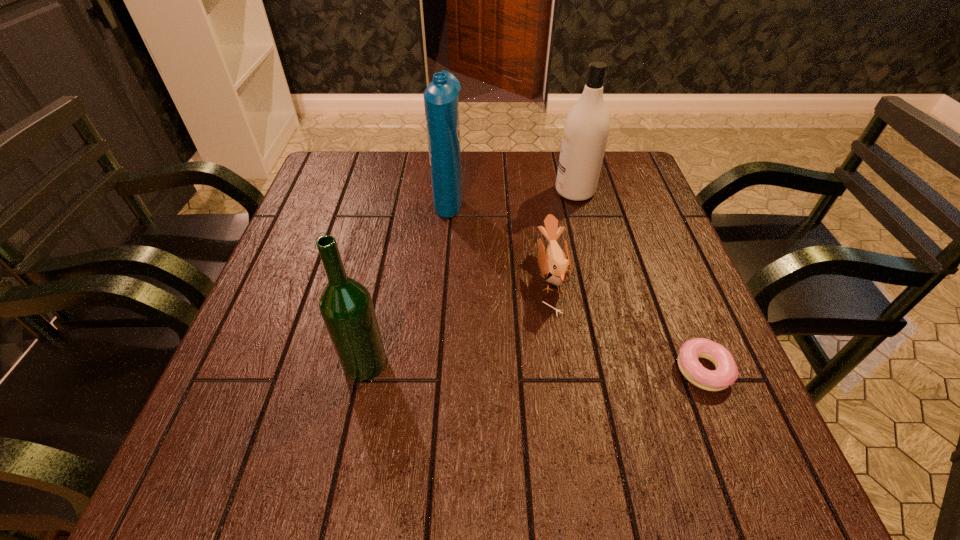
You are a GUI agent. You are given a task and a screenshot of the screen. Output one action in this format:
    pyautogui.click(x=<x>, y=<y>)
    Task: Click on the vacant space positioned on the front-facing side of the fourth object from left to right
    
    Given the screenshot: What is the action you would take?
    pyautogui.click(x=453, y=192)

I want to click on blank area located on the right of the leftmost object, so click(x=477, y=363).

What are the coordinates of `free spot located 0.150m at the beak of the fourth tallest object` in the screenshot? It's located at (468, 277).

You are a GUI agent. You are given a task and a screenshot of the screen. Output one action in this format:
    pyautogui.click(x=<x>, y=<y>)
    Task: Click on the vacant area located at the beak of the fourth tallest object
    This screenshot has width=960, height=540.
    Given the screenshot: What is the action you would take?
    pyautogui.click(x=504, y=277)

In order to click on free spot located 0.320m at the beak of the fourth tallest object in this screenshot , I will do `click(393, 277)`.

What are the coordinates of `free region located on the left of the shortest object` in the screenshot? It's located at (460, 370).

Identify the location of shampoo positioned at the right edge. The image size is (960, 540). (586, 128).

This screenshot has height=540, width=960. I want to click on doughnut that is at the right edge, so click(x=726, y=373).

I want to click on object located at the far right corner, so click(586, 128).

In the image, there is a desktop. Where is `vacant space at the far edge`? The height and width of the screenshot is (540, 960). vacant space at the far edge is located at coordinates (499, 152).